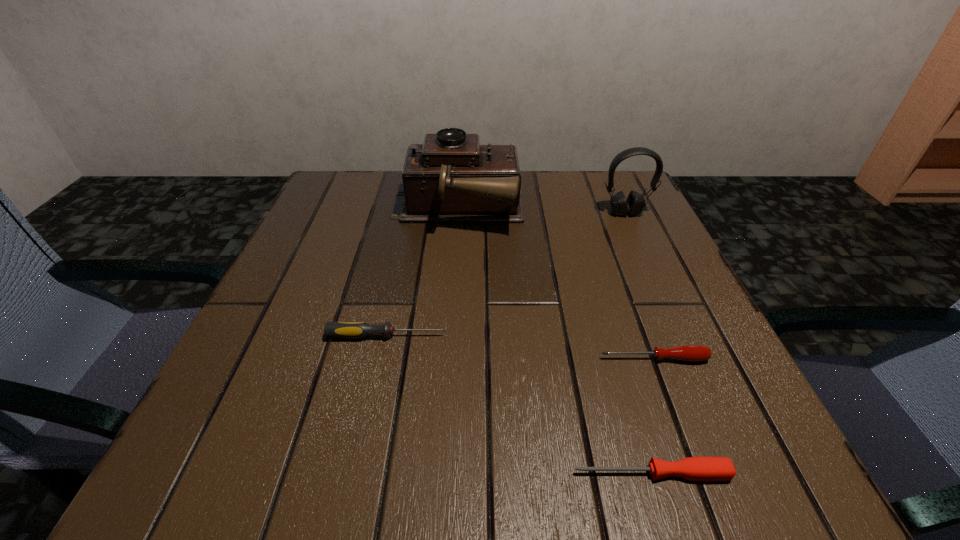
Find the location of a particular element. This screenshot has height=540, width=960. free spot between the phonograph_record and the headset is located at coordinates (541, 212).

In order to click on free space between the phonograph_record and the headset in this screenshot , I will do `click(541, 212)`.

At what (x,y) coordinates should I click in order to perform the action: click on vacant area between the phonograph_record and the second farthest screwdriver. Please return your answer as a coordinate pair (x, y). Looking at the image, I should click on (556, 285).

The width and height of the screenshot is (960, 540). I want to click on unoccupied area between the farthest screwdriver and the headset, so click(506, 274).

You are a GUI agent. You are given a task and a screenshot of the screen. Output one action in this format:
    pyautogui.click(x=<x>, y=<y>)
    Task: Click on the free area in between the nearest screwdriver and the phonograph_record
    
    Given the screenshot: What is the action you would take?
    pyautogui.click(x=554, y=342)

Find the location of `vacant space that is in between the phonograph_record and the leftmost screwdriver`. vacant space that is in between the phonograph_record and the leftmost screwdriver is located at coordinates (422, 273).

You are a GUI agent. You are given a task and a screenshot of the screen. Output one action in this format:
    pyautogui.click(x=<x>, y=<y>)
    Task: Click on the object that stands as the closest to the phonograph_record
    
    Given the screenshot: What is the action you would take?
    click(635, 203)

Locate which object ranks third in proximity to the third farthest object. Please provide its 2D coordinates. Your answer should be formatted as a tuple, i.e. [(x, y)], where the tuple contains the x and y coordinates of a point satisfying the conditions above.

[(700, 468)]

You are a GUI agent. You are given a task and a screenshot of the screen. Output one action in this format:
    pyautogui.click(x=<x>, y=<y>)
    Task: Click on the closest screwdriver to the third nearest object
    The image size is (960, 540).
    Given the screenshot: What is the action you would take?
    pyautogui.click(x=692, y=353)

Image resolution: width=960 pixels, height=540 pixels. Identify the location of screwdriver that is the closest to the nearest object. (692, 353).